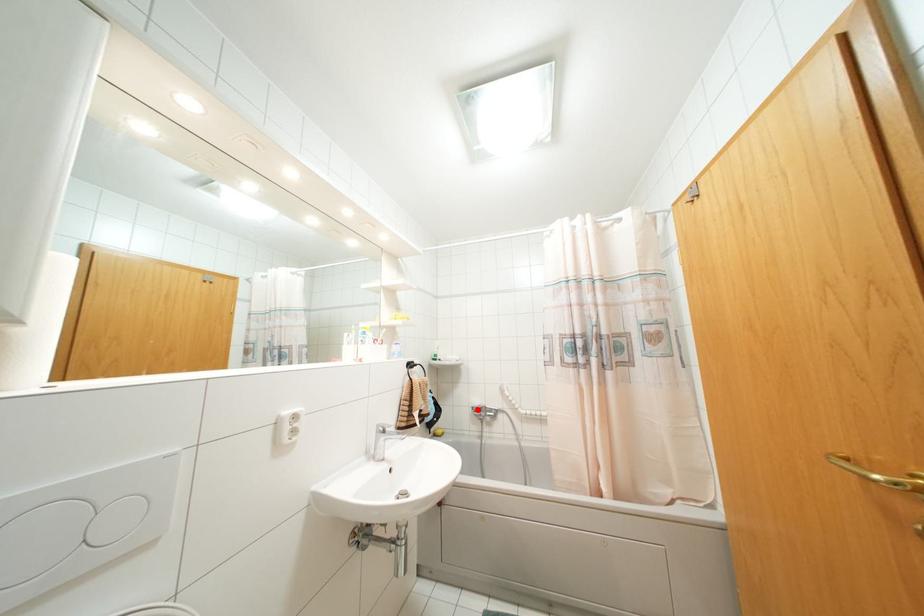
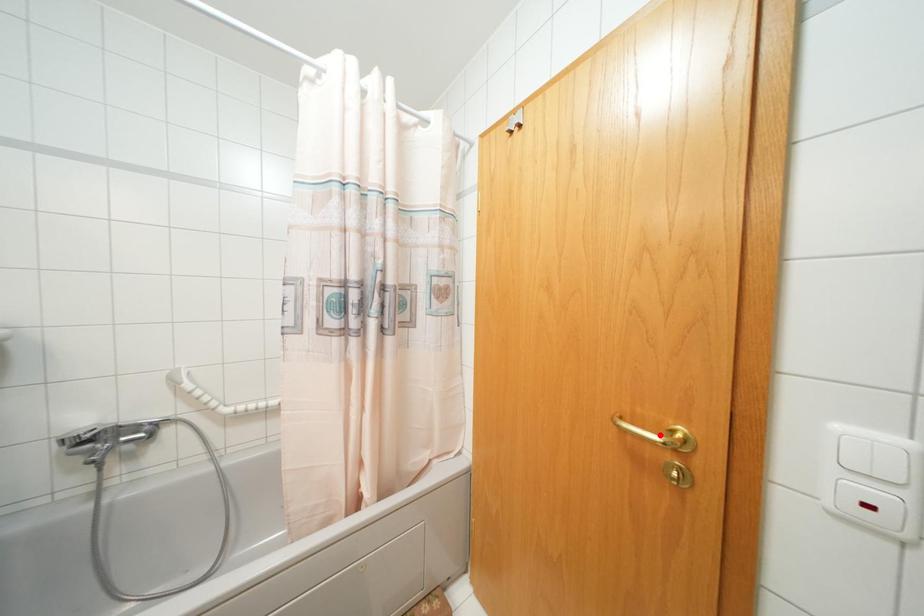
I am providing you with two images of the same scene from different viewpoints. A red point is marked on the first image and another point is marked on the second image. Is the marked point in image1 the same physical position as the marked point in image2?

No